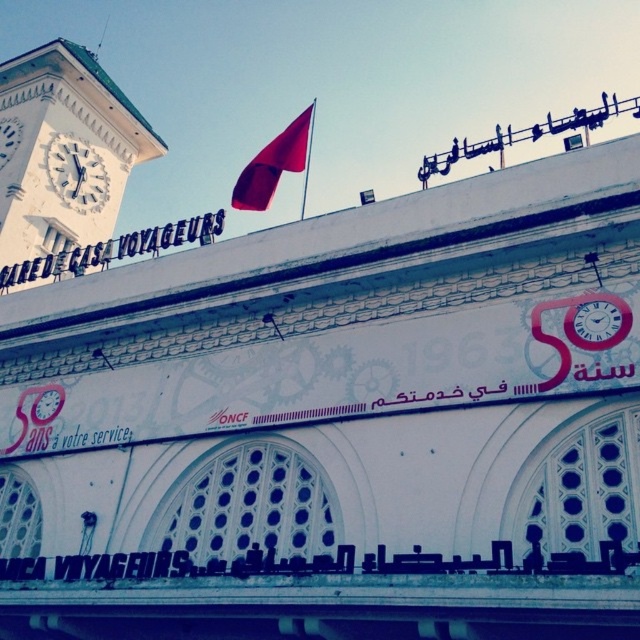
You are a tourist standing in front of the Gare de Casa Voyageurs Railway Station. You notice the white painted stone clock tower at left and the white matte clock at upper left. Which of these two objects is taller?

The white painted stone clock tower at left is taller than the white matte clock at upper left.

You are a delivery person trying to locate the entrance to the Gare de Casa Voyageurs Railway Station. You see the matte red flag at upper center. Based on its position, can you determine if the entrance is to the left or right of the flag?

The entrance to the Gare de Casa Voyageurs Railway Station is not indicated by the position of the matte red flag at upper center, as the provided information only specifies its coordinates at point (275, 164) and does not relate it to the entrance location. Therefore, the flag does not provide directional guidance for finding the entrance.

You are an architect reviewing the design of the Gare de Casa Voyageurs station. You notice the matte red flag at upper center and the white matte clock at upper left. Which object is taller in the design?

The matte red flag at upper center is taller than the white matte clock at upper left.